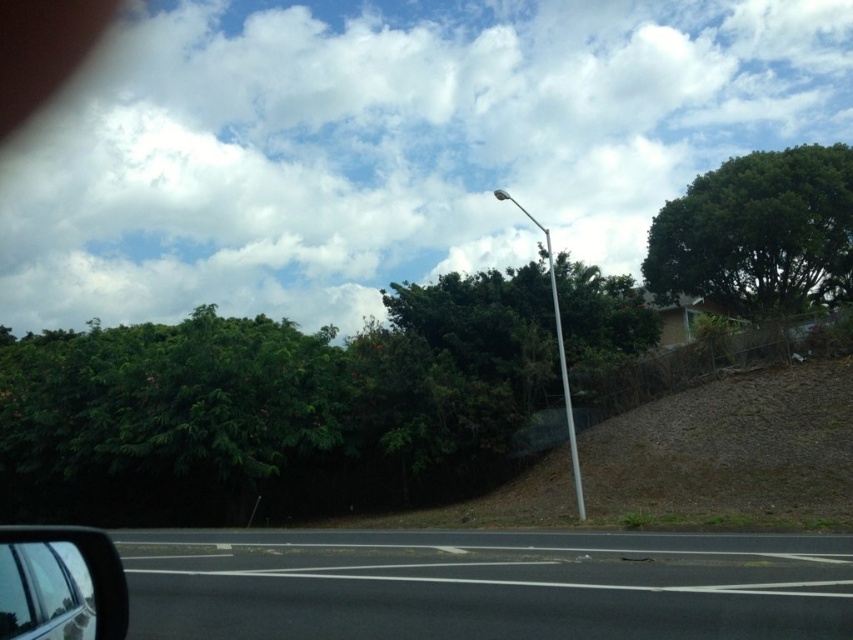
Question: Can you confirm if green leafy tree at center is positioned above white metallic pole at center?

Choices:
 (A) no
 (B) yes

Answer: (A)

Question: Estimate the real-world distances between objects in this image. Which object is closer to the green leafy tree at center?

Choices:
 (A) white metallic pole at center
 (B) green leafy tree at upper right
 (C) clear plastic view mirror at lower left

Answer: (C)

Question: Can you confirm if white fluffy cloud at upper center is thinner than white metallic street light at upper right?

Choices:
 (A) yes
 (B) no

Answer: (B)

Question: Estimate the real-world distances between objects in this image. Which object is closer to the black asphalt road at center?

Choices:
 (A) white metallic street light at upper right
 (B) white fluffy cloud at upper center

Answer: (A)

Question: Does green leafy tree at upper right appear under white metallic street light at upper right?

Choices:
 (A) no
 (B) yes

Answer: (A)

Question: Which object is farther from the camera taking this photo?

Choices:
 (A) white fluffy cloud at upper center
 (B) black asphalt road at center
 (C) clear plastic view mirror at lower left
 (D) green leafy tree at upper right

Answer: (A)